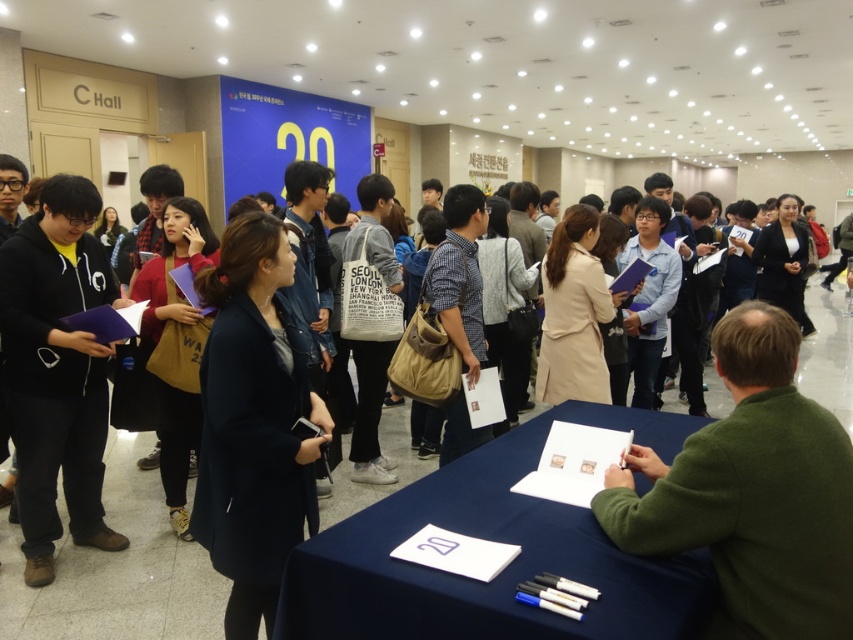
Which of these two, blue fabric table at lower center or black matte hoodie at left, stands taller?

With more height is black matte hoodie at left.

Looking at this image, does blue fabric table at lower center lie behind black matte hoodie at left?

No, blue fabric table at lower center is closer to the viewer.

Which is behind, point (459, 513) or point (22, 484)?

The point (22, 484) is behind.

Find the location of `blue fabric table at lower center`. blue fabric table at lower center is located at coordinates (500, 541).